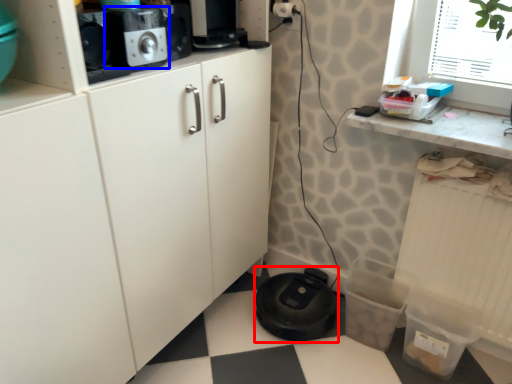
Question: Among these objects, which one is farthest to the camera, appliance (highlighted by a red box) or home appliance (highlighted by a blue box)?

Choices:
 (A) appliance
 (B) home appliance

Answer: (A)